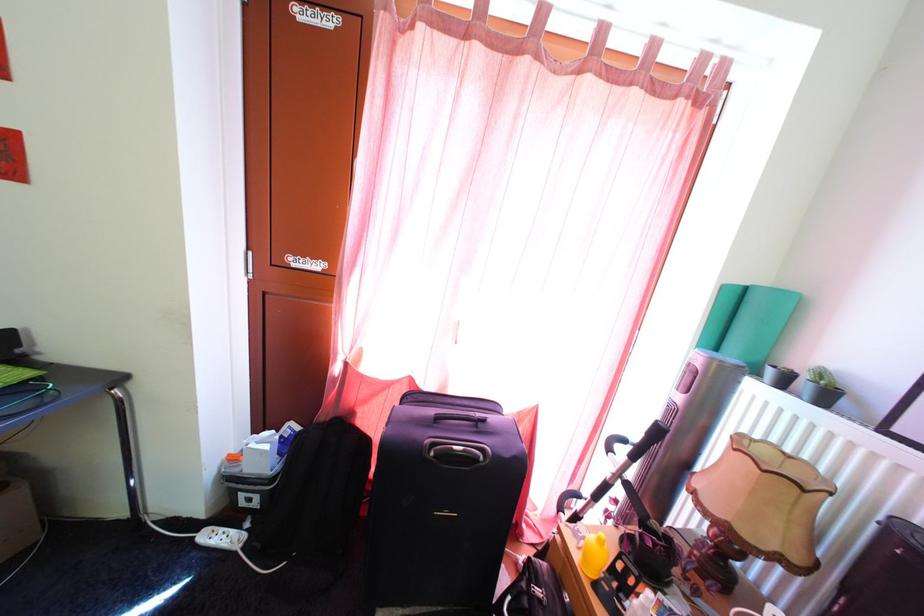
This screenshot has width=924, height=616. I want to click on black backpack, so [x=315, y=493].